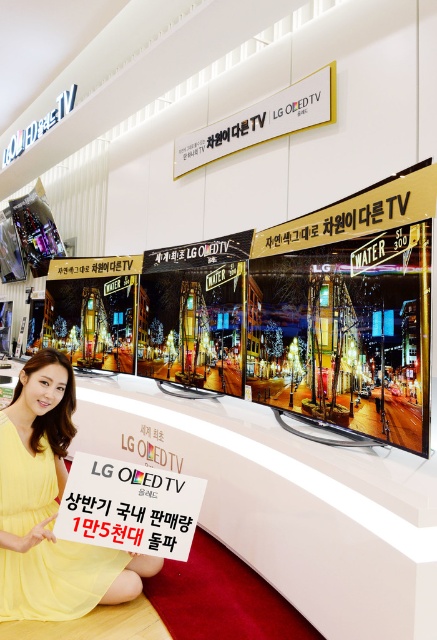
Which is more to the left, yellow fabric dress at center or white paper sign at center?

Positioned to the left is yellow fabric dress at center.

Which is above, yellow fabric dress at center or white paper sign at center?

white paper sign at center

Is point (4, 428) behind point (129, 465)?

No, it is not.

Find the location of a particular element. yellow fabric dress at center is located at coordinates (55, 579).

The image size is (437, 640). Describe the element at coordinates (55, 579) in the screenshot. I see `yellow fabric dress at center` at that location.

Which of these two, yellow fabric dress at center or white metallic sign at upper center, stands taller?

With more height is yellow fabric dress at center.

Measure the distance between point [93,577] and camera.

A distance of 6.68 feet exists between point [93,577] and camera.

You are a GUI agent. You are given a task and a screenshot of the screen. Output one action in this format:
    pyautogui.click(x=<x>, y=<y>)
    Task: Click on the yellow fabric dress at center
    
    Given the screenshot: What is the action you would take?
    pyautogui.click(x=55, y=579)

Looking at this image, is white paper sign at center wider than white metallic sign at upper center?

In fact, white paper sign at center might be narrower than white metallic sign at upper center.

Is white paper sign at center to the right of white metallic sign at upper center from the viewer's perspective?

In fact, white paper sign at center is to the left of white metallic sign at upper center.

At what (x,y) coordinates should I click in order to perform the action: click on white paper sign at center. Please return your answer as a coordinate pair (x, y). Looking at the image, I should click on (129, 506).